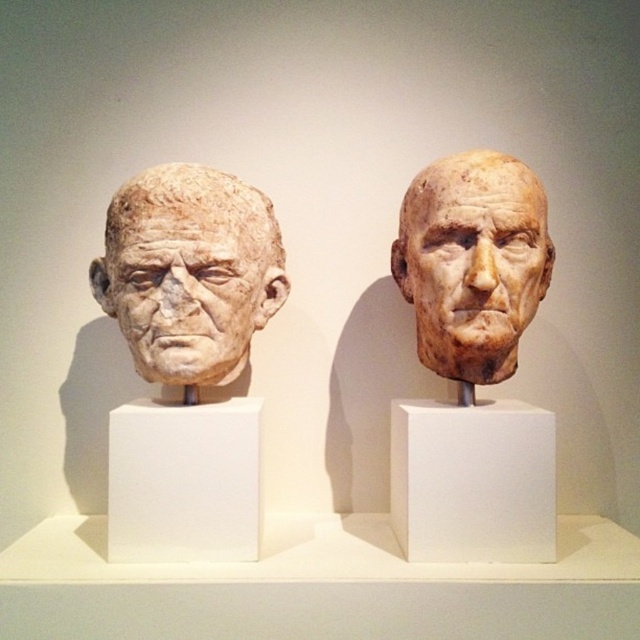
Question: Is the position of matte clay head at center less distant than that of matte stone head at left?

Choices:
 (A) yes
 (B) no

Answer: (A)

Question: In this image, where is matte clay head at center located relative to matte stone head at left?

Choices:
 (A) right
 (B) left

Answer: (A)

Question: Among these points, which one is nearest to the camera?

Choices:
 (A) (540, 268)
 (B) (125, 252)

Answer: (B)

Question: Can you confirm if matte clay head at center is positioned below matte stone head at left?

Choices:
 (A) yes
 (B) no

Answer: (B)